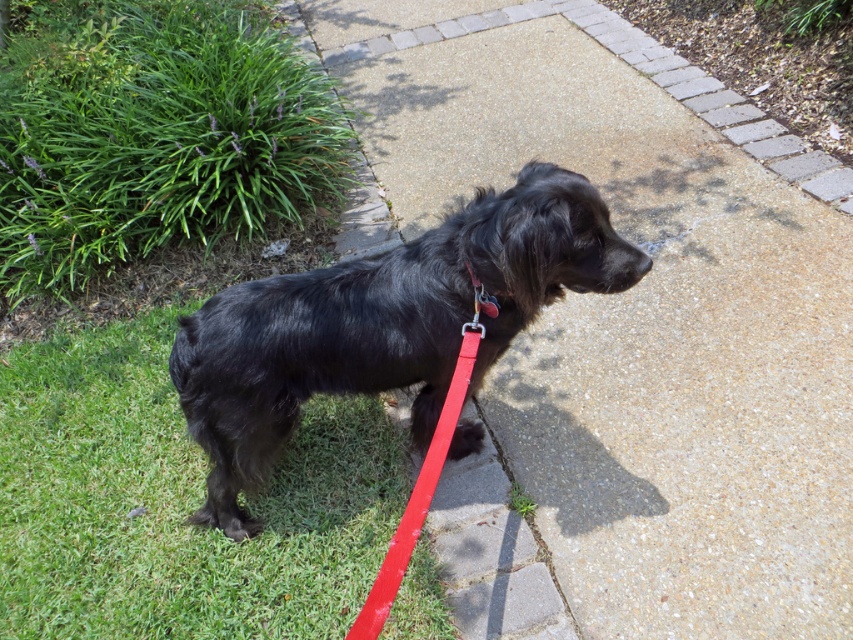
In the scene shown: You are standing at the point with coordinates point [259,444] and want to walk to the point with coordinates point [668,556]. Given that the paved pathway is straight and runs from the bottom left to the top right of the image, will you have to cross the pathway to reach your destination?

Point [668,556] is behind point [259,444], so you will have to cross the pathway to reach your destination.

In the scene shown: You are a dog owner trying to decide whether to let your dog off the leash. Based on the scene, which object is located higher up in the image, the smooth concrete pavement at center or the red leather collar at center?

The smooth concrete pavement at center is above the red leather collar at center, so the pavement is higher up in the image.

You are standing on the grassy area where the black dog is located. You want to walk to the smooth concrete pavement at center. Which direction should you walk?

You should walk towards the center of the image to reach the smooth concrete pavement at center.